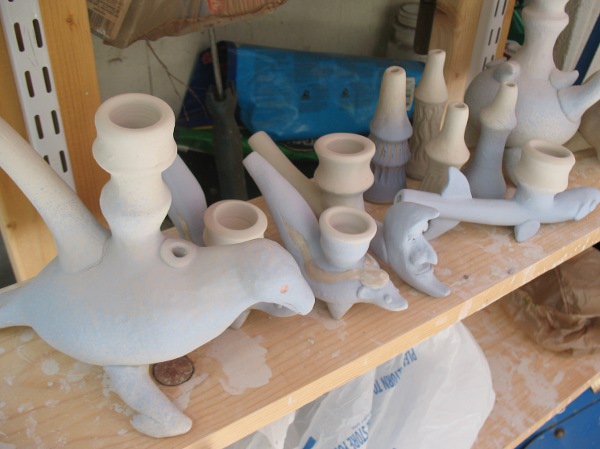
Where is `left shelf bracing`? The image size is (600, 449). left shelf bracing is located at coordinates (39, 83).